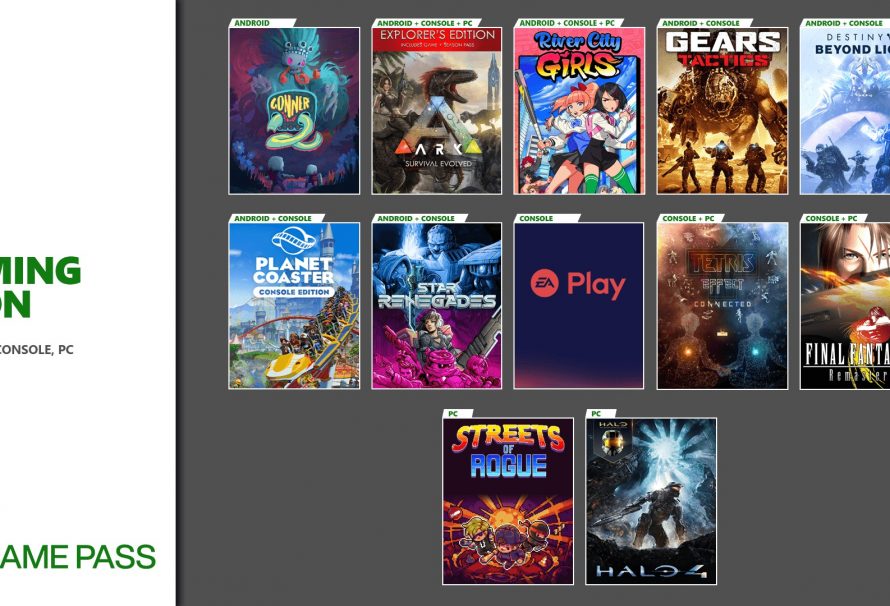
Where is `console`? console is located at coordinates (568, 214).